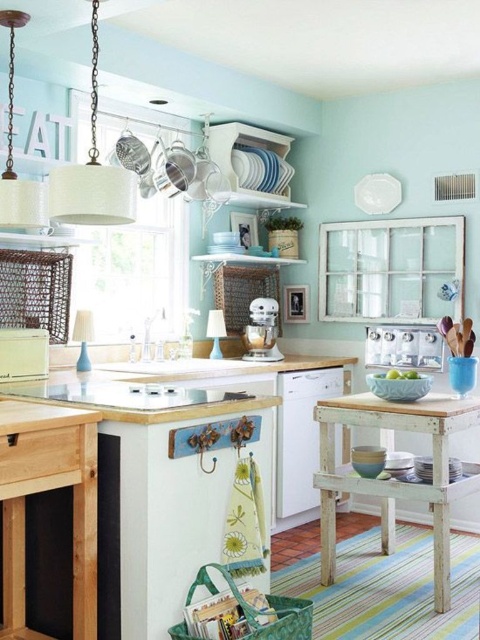
Which is below, white distressed wood table at lower right or white matte stand mixer at center?

white distressed wood table at lower right is lower down.

Is white distressed wood table at lower right bigger than white matte stand mixer at center?

Indeed, white distressed wood table at lower right has a larger size compared to white matte stand mixer at center.

Which is in front, point (445, 509) or point (265, 330)?

Point (445, 509)

Locate an element on the screen. The width and height of the screenshot is (480, 640). white distressed wood table at lower right is located at coordinates (395, 480).

Does white glossy sink at center appear on the left side of white matte refrigerator at lower left?

In fact, white glossy sink at center is to the right of white matte refrigerator at lower left.

Does white glossy sink at center appear over white matte refrigerator at lower left?

No, white glossy sink at center is not above white matte refrigerator at lower left.

Which is in front, point (371, 355) or point (39, 365)?

Point (39, 365)

Where is `white glossy sink at center`? The width and height of the screenshot is (480, 640). white glossy sink at center is located at coordinates (404, 346).

Is white glossy countertop at center shorter than white matte stand mixer at center?

Indeed, white glossy countertop at center has a lesser height compared to white matte stand mixer at center.

Is white glossy countertop at center thinner than white matte stand mixer at center?

No.

Is point (127, 400) positioned before point (251, 353)?

Yes, it is in front of point (251, 353).

Where is `white glossy countertop at center`? white glossy countertop at center is located at coordinates (166, 387).